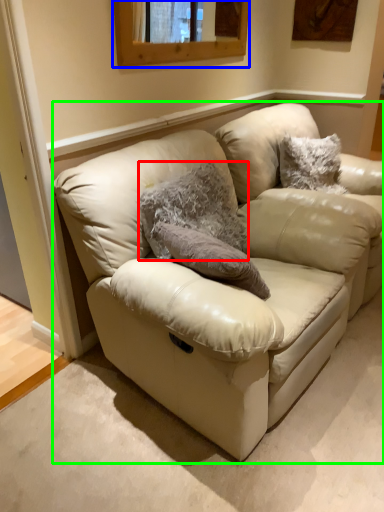
Question: Which object is the farthest from animal (highlighted by a red box)? Choose among these: window (highlighted by a blue box) or studio couch (highlighted by a green box).

Choices:
 (A) window
 (B) studio couch

Answer: (A)